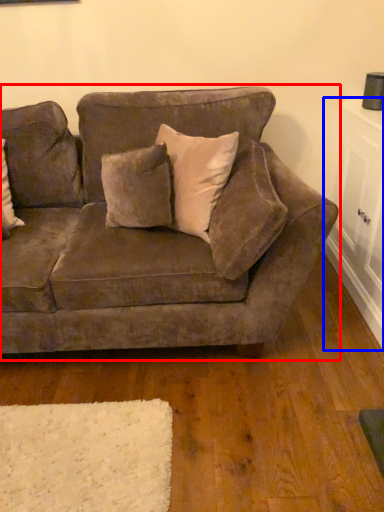
Question: Which object is closer to the camera taking this photo, studio couch (highlighted by a red box) or table (highlighted by a blue box)?

Choices:
 (A) studio couch
 (B) table

Answer: (A)